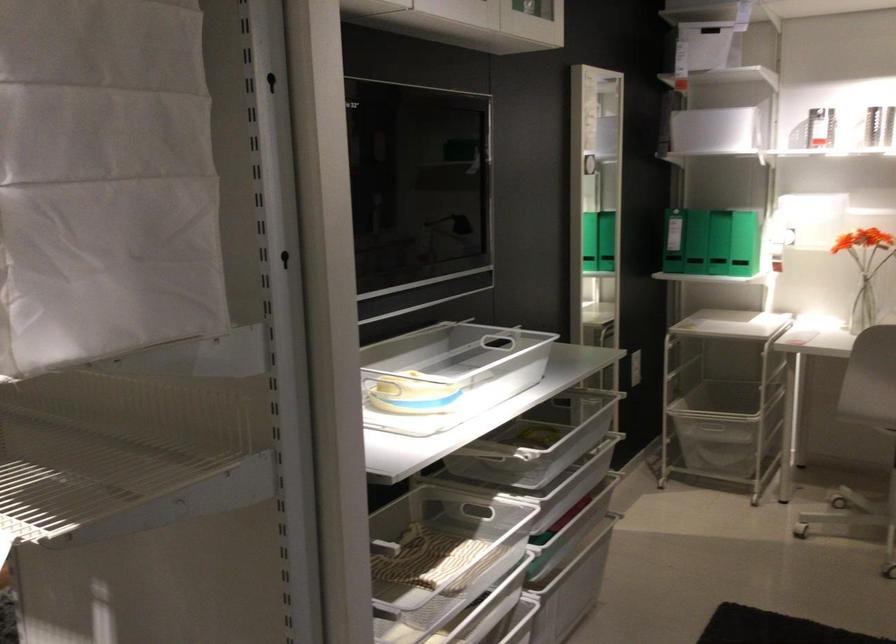
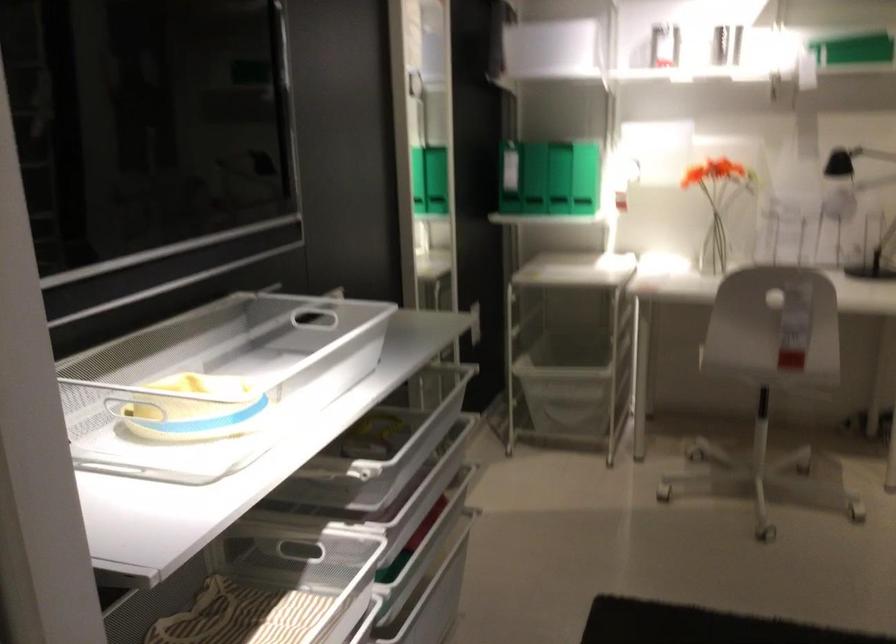
Question: I am providing you with two images of the same scene from different viewpoints. Which of the following objects are not visible in image2?

Choices:
 (A) dark brown book
 (B) white mesh basket
 (C) glass vase
 (D) small yellow bowl

Answer: (D)